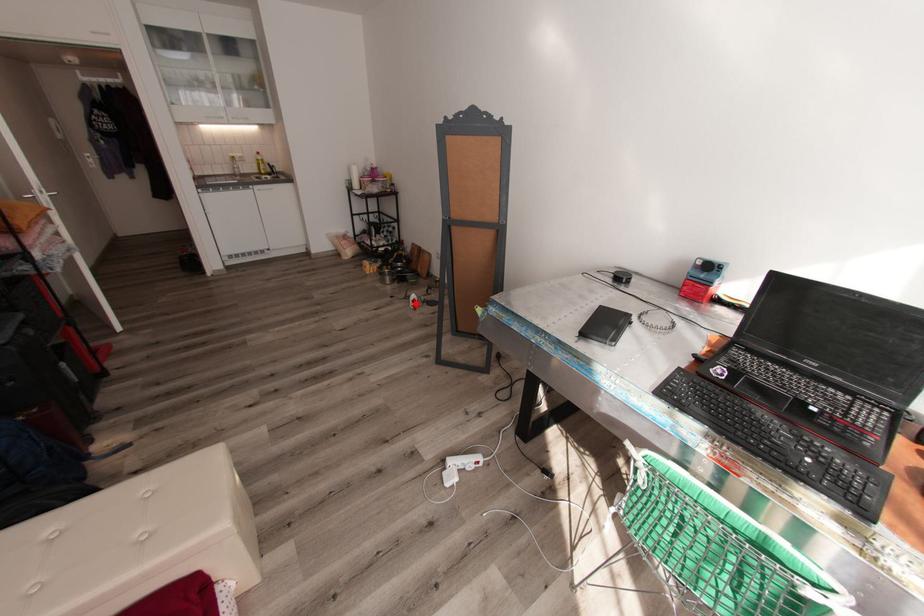
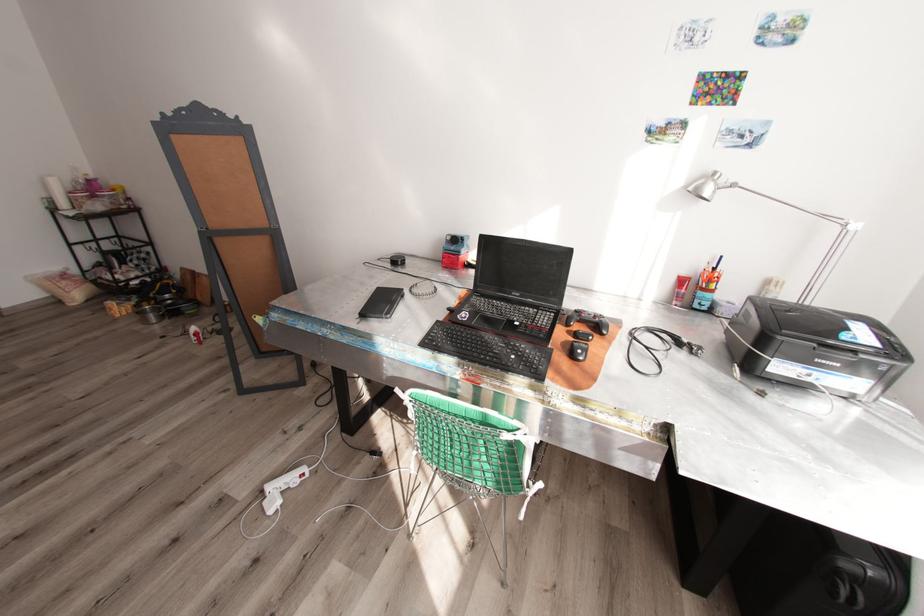
The point at the highlighted location is marked in the first image. Where is the corresponding point in the second image?

(199, 338)